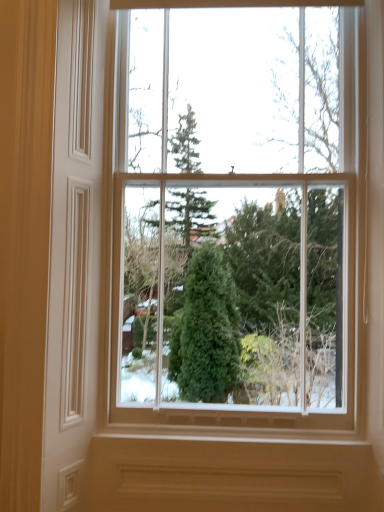
Describe the element at coordinates (230, 209) in the screenshot. The height and width of the screenshot is (512, 384). I see `clear glass window at center` at that location.

Identify the location of clear glass window at center. (230, 209).

The height and width of the screenshot is (512, 384). Identify the location of clear glass window at center. (230, 209).